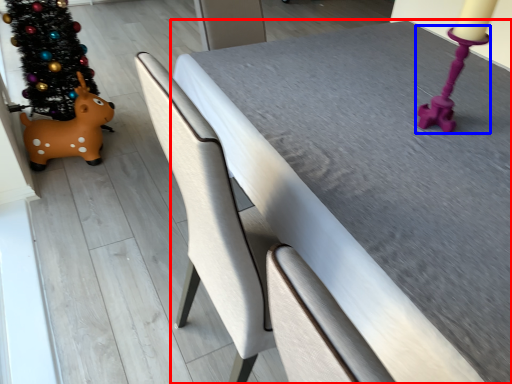
Question: Which object is closer to the camera taking this photo, table (highlighted by a red box) or candle holder (highlighted by a blue box)?

Choices:
 (A) table
 (B) candle holder

Answer: (A)